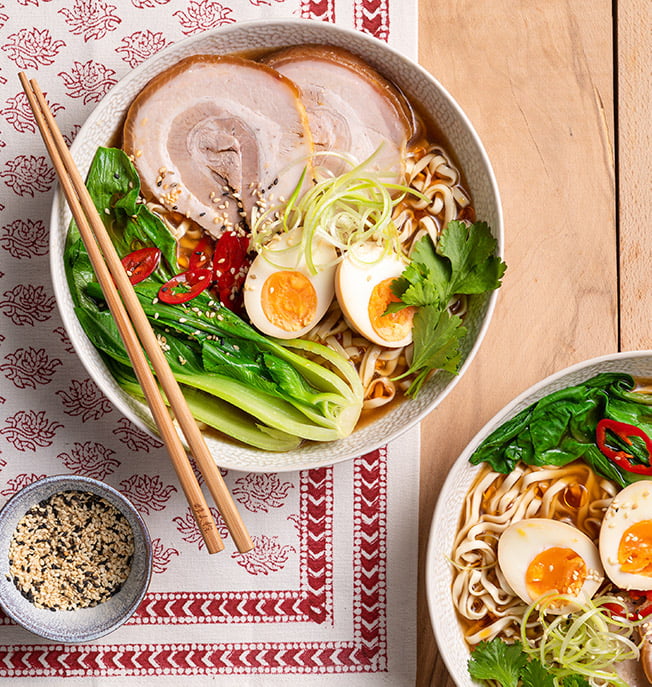
Find the location of a particular element. plate is located at coordinates (443, 624).